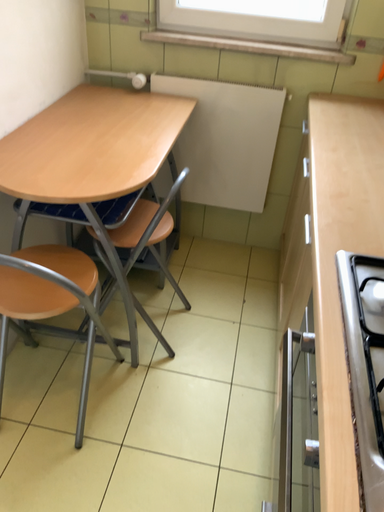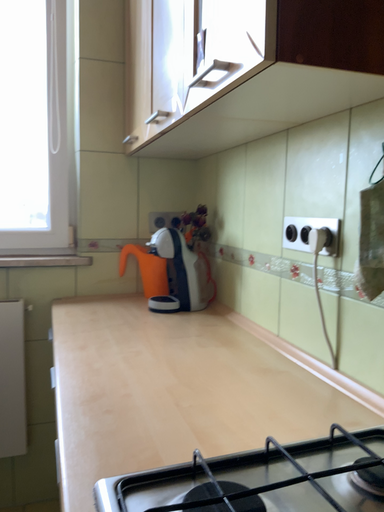
Question: Which way did the camera rotate in the video?

Choices:
 (A) rotated upward
 (B) rotated downward

Answer: (A)